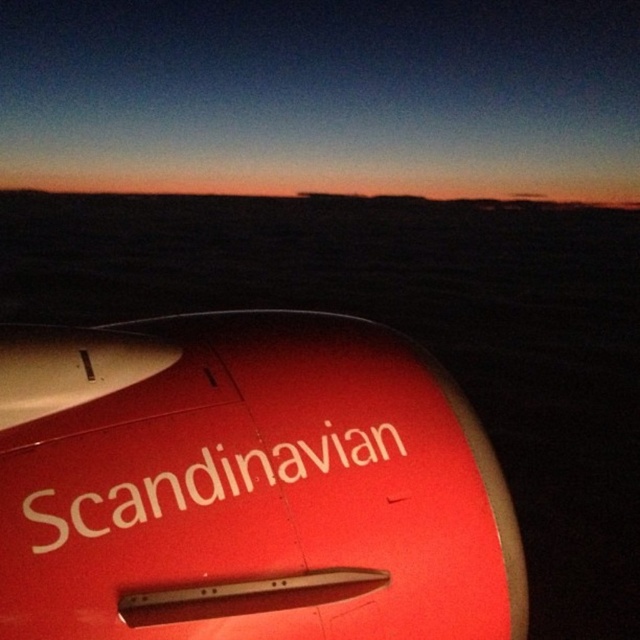
You are a flight attendant who needs to reach the emergency exit located at the back of the airplane. You are currently standing near the matte red airplane at center. Can you walk directly to the matte red airplane wing at upper left without any obstacles?

The distance between the matte red airplane at center and the matte red airplane wing at upper left is 5.77 inches. Since this distance is extremely short, you can easily walk directly to the matte red airplane wing at upper left without any obstacles.

You are a passenger sitting in the airplane and looking out the window. You see the matte red airplane at center and the matte red airplane wing at upper left. Which object is positioned higher in your view?

The matte red airplane at center is positioned higher than the matte red airplane wing at upper left according to the description.